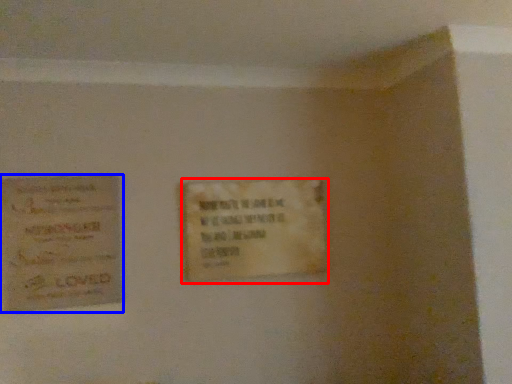
Question: Which object is further to the camera taking this photo, plaque (highlighted by a red box) or poster (highlighted by a blue box)?

Choices:
 (A) plaque
 (B) poster

Answer: (A)